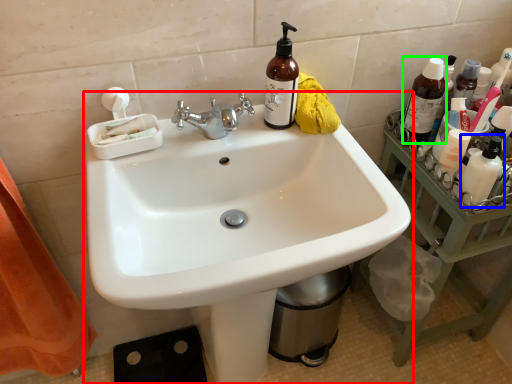
Question: Considering the real-world distances, which object is closest to sink (highlighted by a red box)? toiletry (highlighted by a blue box) or bottle (highlighted by a green box).

Choices:
 (A) toiletry
 (B) bottle

Answer: (A)